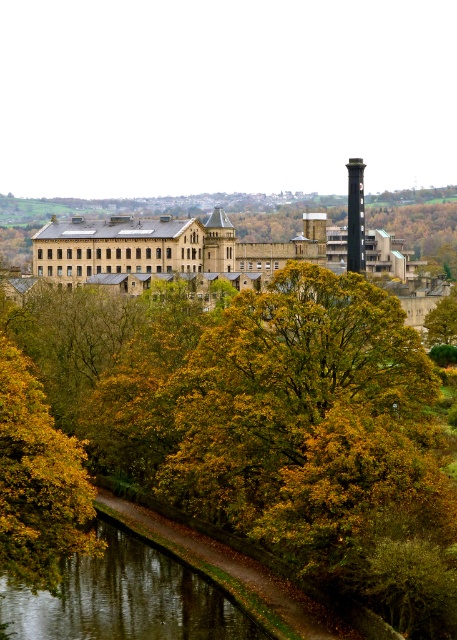
Question: Which of the following is the closest to the observer?

Choices:
 (A) coord(38,636)
 (B) coord(341,573)
 (C) coord(350,264)

Answer: (B)

Question: Which point is farther from the camera taking this photo?

Choices:
 (A) click(19, 618)
 (B) click(352, 163)
 (C) click(229, 364)

Answer: (B)

Question: From the image, what is the correct spatial relationship of yellow-green foliage at center in relation to reflective smooth water at lower left?

Choices:
 (A) right
 (B) left

Answer: (A)

Question: Which point is farther from the camera taking this photo?

Choices:
 (A) (232, 616)
 (B) (350, 179)

Answer: (B)

Question: Is reflective smooth water at lower left thinner than smooth gray chimney at center?

Choices:
 (A) yes
 (B) no

Answer: (B)

Question: Does yellow-green foliage at center appear under reflective smooth water at lower left?

Choices:
 (A) yes
 (B) no

Answer: (B)